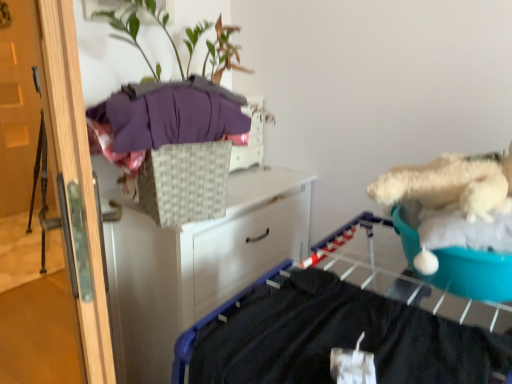
Question: From a real-world perspective, is wooden door at left below green leafy plant at upper center?

Choices:
 (A) yes
 (B) no

Answer: (A)

Question: Is wooden door at left in front of green leafy plant at upper center?

Choices:
 (A) no
 (B) yes

Answer: (B)

Question: Is wooden door at left at the left side of green leafy plant at upper center?

Choices:
 (A) no
 (B) yes

Answer: (B)

Question: Does wooden door at left have a greater height compared to green leafy plant at upper center?

Choices:
 (A) yes
 (B) no

Answer: (A)

Question: Is wooden door at left smaller than green leafy plant at upper center?

Choices:
 (A) yes
 (B) no

Answer: (B)

Question: In the image, is white woven basket at upper center positioned in front of or behind white woven basket at upper center?

Choices:
 (A) behind
 (B) front

Answer: (A)

Question: Would you say white woven basket at upper center is inside or outside white woven basket at upper center?

Choices:
 (A) outside
 (B) inside

Answer: (A)

Question: Is white woven basket at upper center bigger or smaller than white woven basket at upper center?

Choices:
 (A) big
 (B) small

Answer: (A)

Question: In terms of height, does white woven basket at upper center look taller or shorter compared to white woven basket at upper center?

Choices:
 (A) short
 (B) tall

Answer: (B)

Question: From a real-world perspective, is teal fabric at right above or below white woven basket at upper center?

Choices:
 (A) below
 (B) above

Answer: (A)

Question: Would you say teal fabric at right is inside or outside white woven basket at upper center?

Choices:
 (A) inside
 (B) outside

Answer: (B)

Question: Is teal fabric at right wider or thinner than white woven basket at upper center?

Choices:
 (A) wide
 (B) thin

Answer: (A)

Question: From their relative heights in the image, would you say teal fabric at right is taller or shorter than white woven basket at upper center?

Choices:
 (A) short
 (B) tall

Answer: (A)

Question: In terms of height, does teal fabric at right look taller or shorter compared to green leafy plant at upper center?

Choices:
 (A) short
 (B) tall

Answer: (A)

Question: Looking at the image, does teal fabric at right seem bigger or smaller compared to green leafy plant at upper center?

Choices:
 (A) small
 (B) big

Answer: (A)